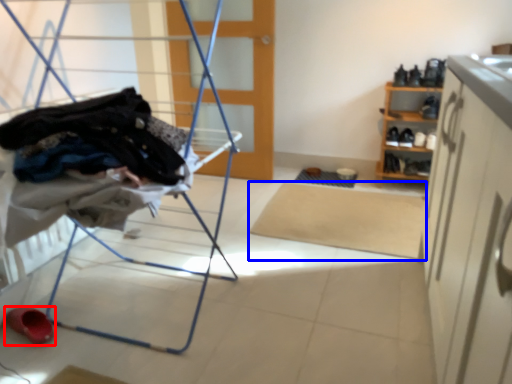
Question: Which of the following is the closest to the observer, footwear (highlighted by a red box) or mat (highlighted by a blue box)?

Choices:
 (A) footwear
 (B) mat

Answer: (A)